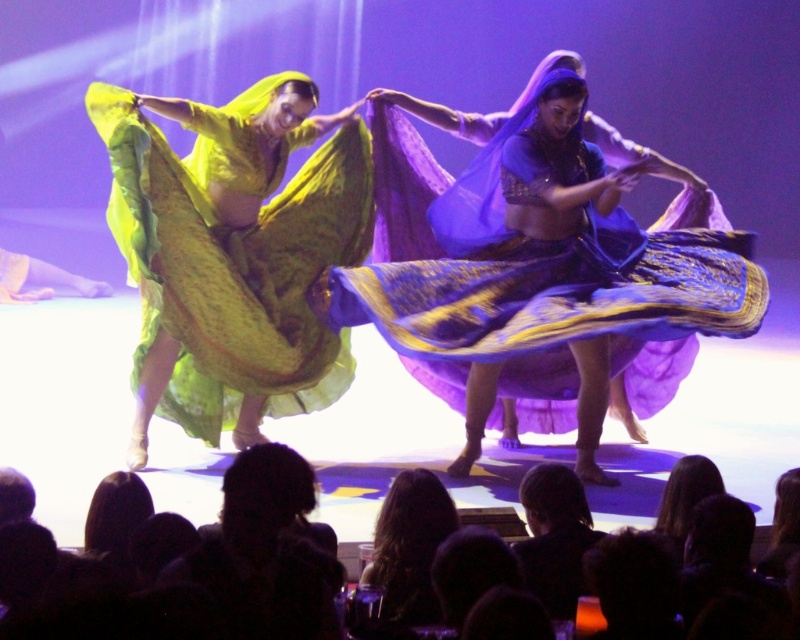
Does matte purple fabric at center lie behind matte green fabric at left?

That is False.

The height and width of the screenshot is (640, 800). In order to click on matte purple fabric at center in this screenshot , I will do `click(552, 268)`.

Locate an element on the screen. matte purple fabric at center is located at coordinates (552, 268).

Does matte green fabric at left appear over dark fabric headscarf at lower center?

Yes.

Who is positioned more to the left, matte green fabric at left or dark fabric headscarf at lower center?

matte green fabric at left

Which is behind, point (288, 202) or point (560, 602)?

Point (288, 202)

The image size is (800, 640). In order to click on matte green fabric at left in this screenshot , I will do `click(234, 252)`.

Is matte purple fabric at center smaller than dark fabric headscarf at lower center?

Incorrect, matte purple fabric at center is not smaller in size than dark fabric headscarf at lower center.

Who is positioned more to the left, matte purple fabric at center or dark fabric headscarf at lower center?

From the viewer's perspective, dark fabric headscarf at lower center appears more on the left side.

Between point (541, 305) and point (570, 593), which one is positioned behind?

The point (541, 305) is more distant.

You are a GUI agent. You are given a task and a screenshot of the screen. Output one action in this format:
    pyautogui.click(x=<x>, y=<y>)
    Task: Click on the matte purple fabric at center
    Image resolution: width=800 pixels, height=640 pixels.
    Given the screenshot: What is the action you would take?
    pyautogui.click(x=552, y=268)